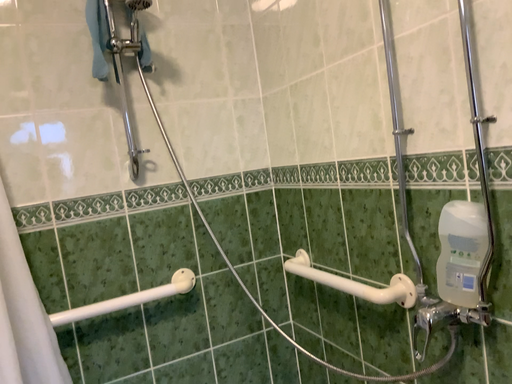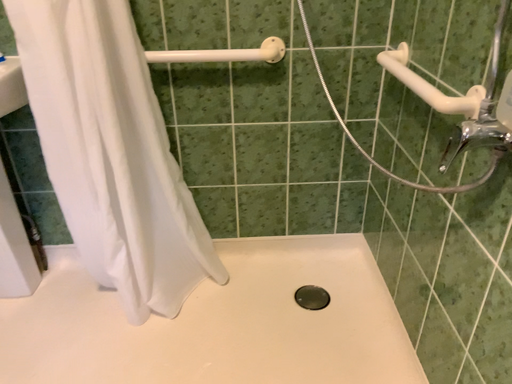
Question: Which way did the camera rotate in the video?

Choices:
 (A) rotated upward
 (B) rotated downward

Answer: (B)